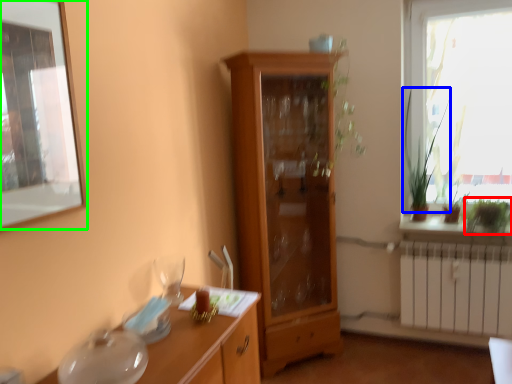
Question: Which object is the farthest from plant (highlighted by a red box)? Choose among these: plant (highlighted by a blue box) or window screen (highlighted by a green box).

Choices:
 (A) plant
 (B) window screen

Answer: (B)